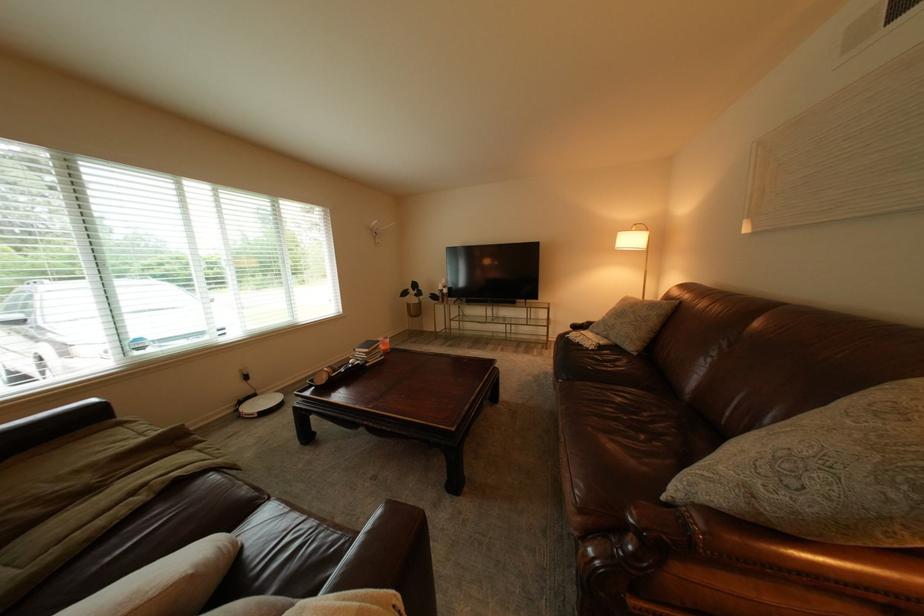
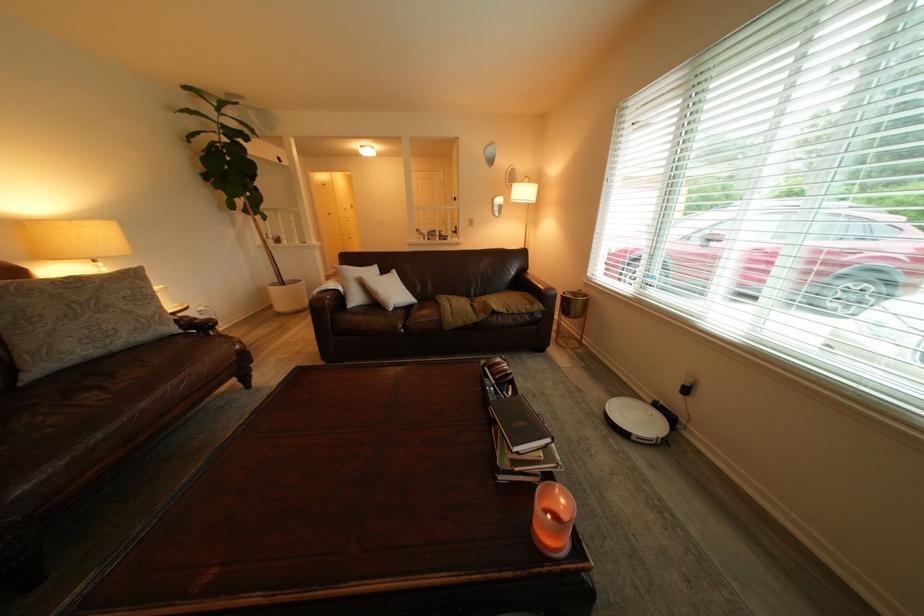
In the second image, find the point that corresponds to the point at 346,376 in the first image.

(500, 369)